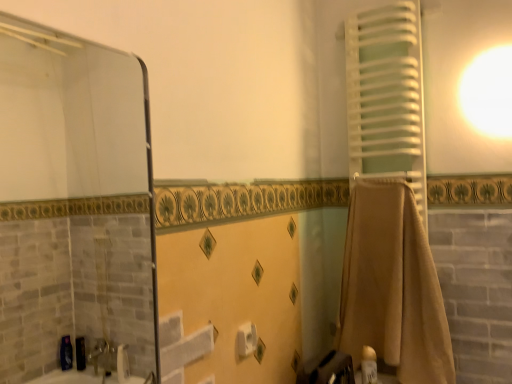
Question: From the image's perspective, relative to white matte towel at right, is transparent glass mirror at upper left above or below?

Choices:
 (A) below
 (B) above

Answer: (A)

Question: In terms of width, does transparent glass mirror at upper left look wider or thinner when compared to white matte towel at right?

Choices:
 (A) wide
 (B) thin

Answer: (B)

Question: Which object is positioned farthest from the beige cotton towel at right?

Choices:
 (A) white matte towel at right
 (B) white matte toilet paper at center
 (C) transparent glass mirror at upper left
 (D) white glossy lotion at lower right

Answer: (C)

Question: Considering the real-world distances, which object is farthest from the beige cotton towel at right?

Choices:
 (A) white glossy lotion at lower right
 (B) transparent glass mirror at upper left
 (C) white matte towel at right
 (D) white matte toilet paper at center

Answer: (B)